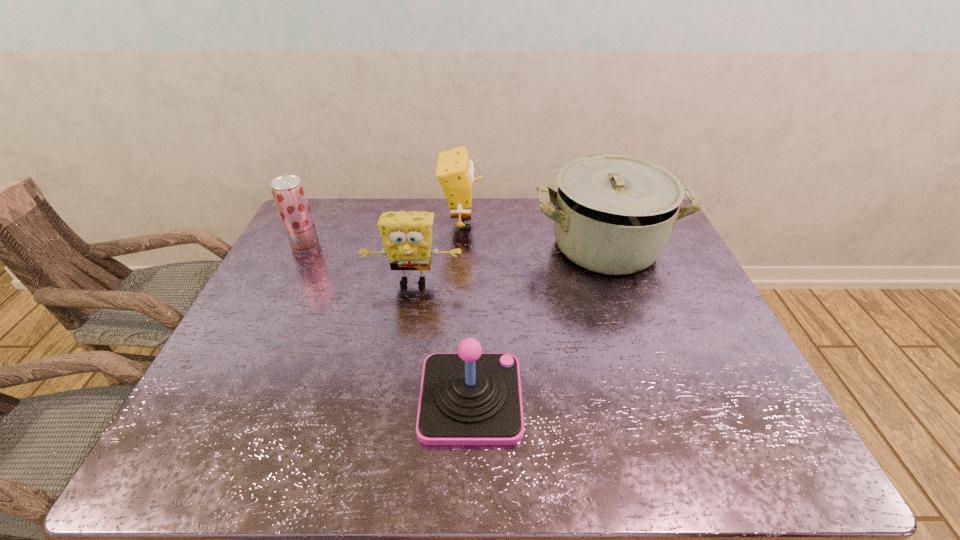
You are a GUI agent. You are given a task and a screenshot of the screen. Output one action in this format:
    pyautogui.click(x=<x>, y=<y>)
    Task: Click on the free space located 0.310m forward from the base of the nearest object
    The image size is (960, 540).
    Given the screenshot: What is the action you would take?
    pyautogui.click(x=658, y=399)

Locate an element on the screen. Image resolution: width=960 pixels, height=540 pixels. sponge present at the far edge is located at coordinates (455, 171).

Image resolution: width=960 pixels, height=540 pixels. I want to click on saucepan present at the far edge, so click(614, 214).

You are a GUI agent. You are given a task and a screenshot of the screen. Output one action in this format:
    pyautogui.click(x=<x>, y=<y>)
    Task: Click on the object at the near edge
    
    Given the screenshot: What is the action you would take?
    pyautogui.click(x=467, y=398)

In order to click on object positioned at the left edge in this screenshot , I will do `click(288, 191)`.

Where is `object at the right edge`? The height and width of the screenshot is (540, 960). object at the right edge is located at coordinates click(614, 214).

Find the location of a particular element. This screenshot has height=540, width=960. object situated at the far right corner is located at coordinates (614, 214).

The image size is (960, 540). In order to click on vacant space at the far edge of the desktop in this screenshot , I will do `click(379, 208)`.

In the image, there is a desktop. Where is `vacant space at the near edge`? vacant space at the near edge is located at coordinates (440, 446).

Where is `free region at the left edge of the desktop`? This screenshot has width=960, height=540. free region at the left edge of the desktop is located at coordinates (288, 245).